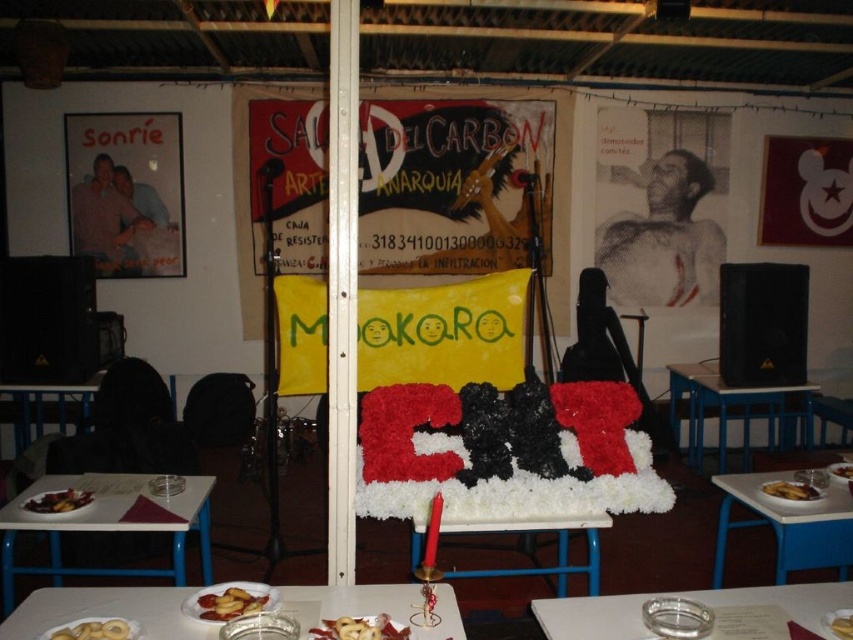
Question: Which point is farther to the camera?

Choices:
 (A) (132, 632)
 (B) (788, 484)
 (C) (195, 497)

Answer: (B)

Question: Does clear glass ashtray at lower right have a larger size compared to yellow matte plate at center?

Choices:
 (A) no
 (B) yes

Answer: (B)

Question: Among these points, which one is nearest to the camera?

Choices:
 (A) (405, 627)
 (B) (360, 612)
 (C) (834, 468)

Answer: (A)

Question: Among these objects, which one is nearest to the camera?

Choices:
 (A) white plastic table at lower left
 (B) white glossy plate at lower left
 (C) translucent glass plate at lower center
 (D) white plastic table at lower right

Answer: (B)

Question: Does white glossy plate at lower center appear on the left side of yellow matte plate at center?

Choices:
 (A) yes
 (B) no

Answer: (A)

Question: Is matte paper poster at center positioned behind white glossy plate at lower center?

Choices:
 (A) no
 (B) yes

Answer: (B)